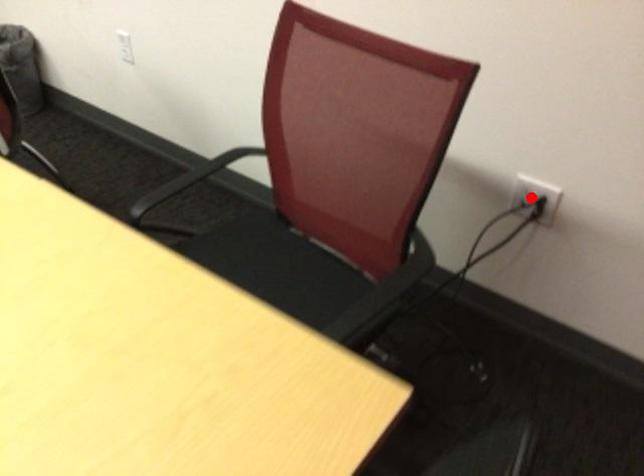
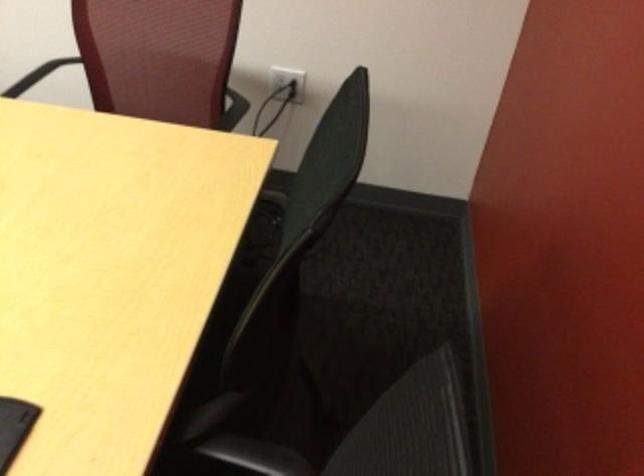
The point at the highlighted location is marked in the first image. Where is the corresponding point in the second image?

(288, 81)